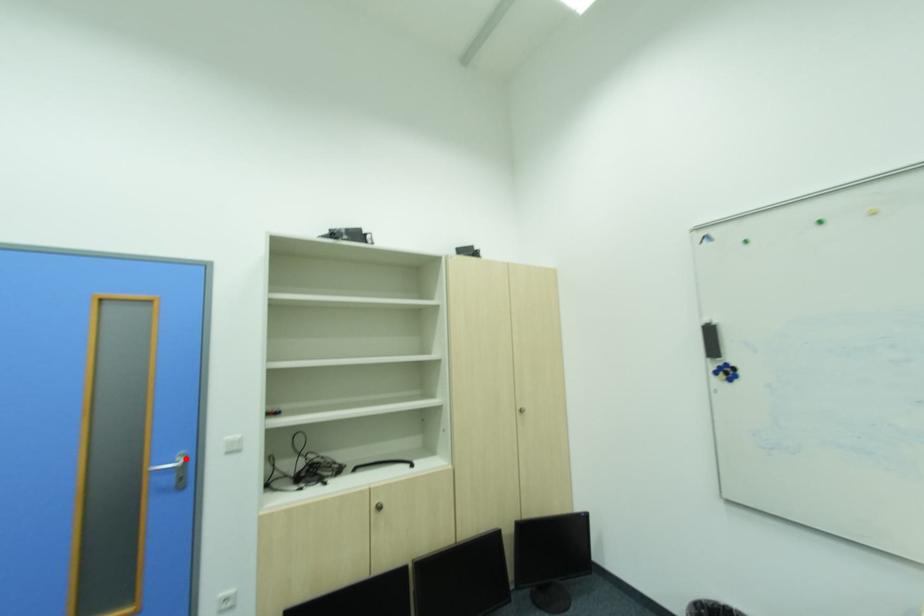
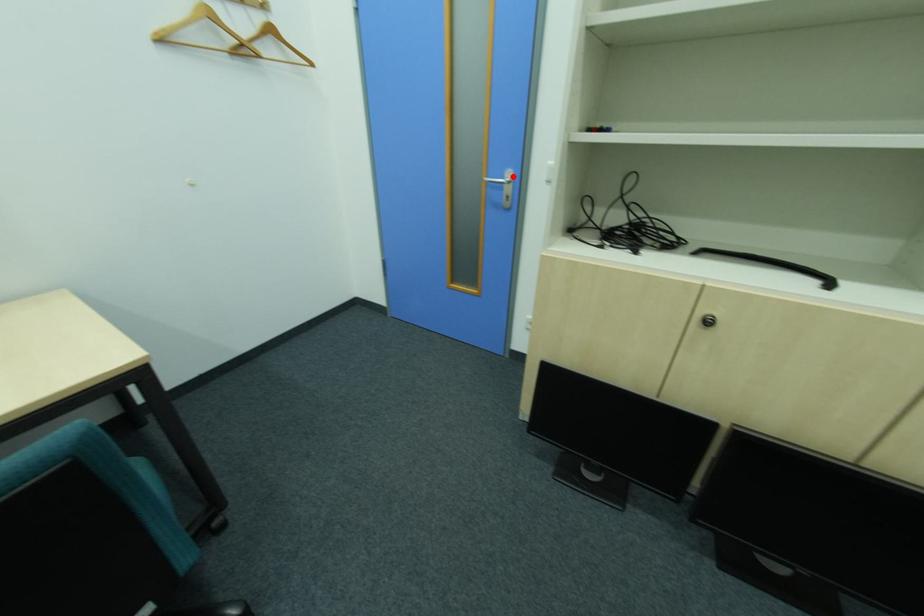
I am providing you with two images of the same scene from different viewpoints. A red point is marked on the first image and another point is marked on the second image. Is the red point in image1 aligned with the point shown in image2?

Yes